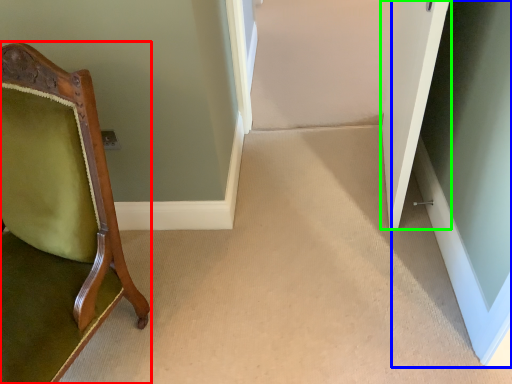
Question: Estimate the real-world distances between objects in this image. Which object is closer to chair (highlighted by a red box), glass door (highlighted by a blue box) or door (highlighted by a green box)?

Choices:
 (A) glass door
 (B) door

Answer: (B)